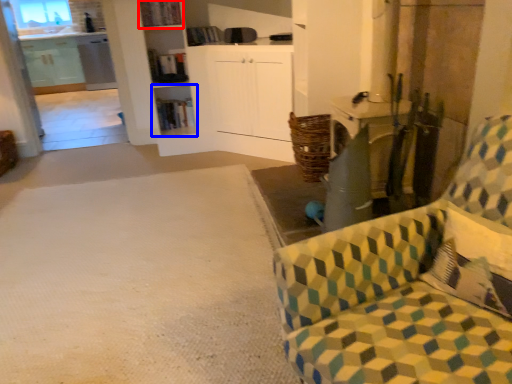
Question: Among these objects, which one is farthest to the camera, shelf (highlighted by a red box) or shelf (highlighted by a blue box)?

Choices:
 (A) shelf
 (B) shelf

Answer: (B)